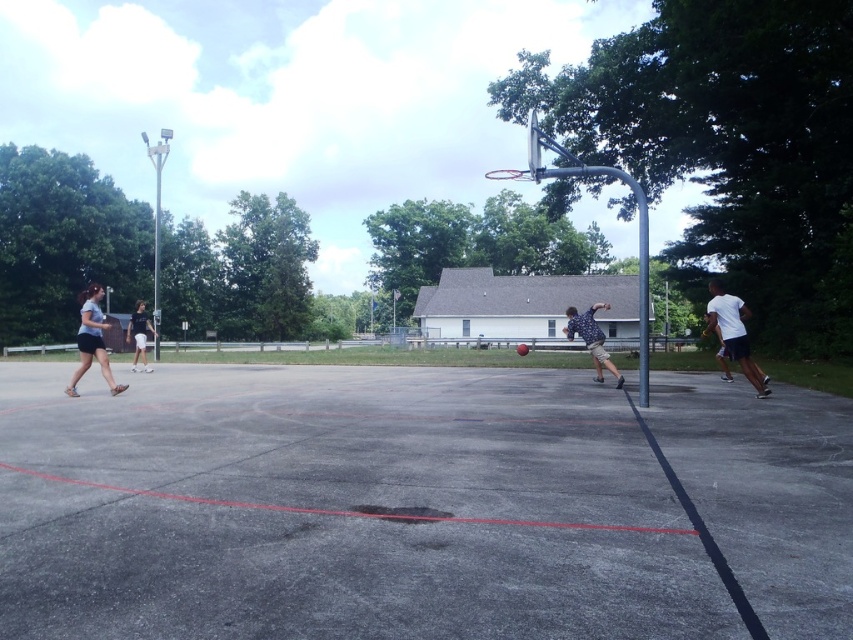
You are standing at the center of the basketball court and want to throw a ball to the white matte shirt at right. Based on the coordinates provided, in which general direction should you aim your throw?

The white matte shirt at right is located at coordinates point (733, 332), which translates to the right side of the court. Therefore, you should aim your throw to the right direction towards the white matte shirt at right.

You are a photographer setting up a shot of the basketball player. You need to ensure both the patterned shirt at center and white cotton shorts at left are clearly visible. Which clothing item should you focus on first to ensure proper exposure, considering their sizes?

The patterned shirt at center has a smaller size compared to white cotton shorts at left, so you should focus on the patterned shirt at center first to ensure its details are properly exposed before adjusting for the larger area of the white cotton shorts at left.

You are standing at the point marked as point (737, 300) on the court. You want to throw a ball to a friend who is standing 12 meters away from you. Is your friend within the distance you can throw the ball if your maximum throwing distance is 10.87 meters?

The distance of point (737, 300) from viewer is 10.87 meters, so if your friend is standing 12 meters away from you, they are beyond your maximum throwing distance of 10.87 meters. Therefore, your friend is out of reach.